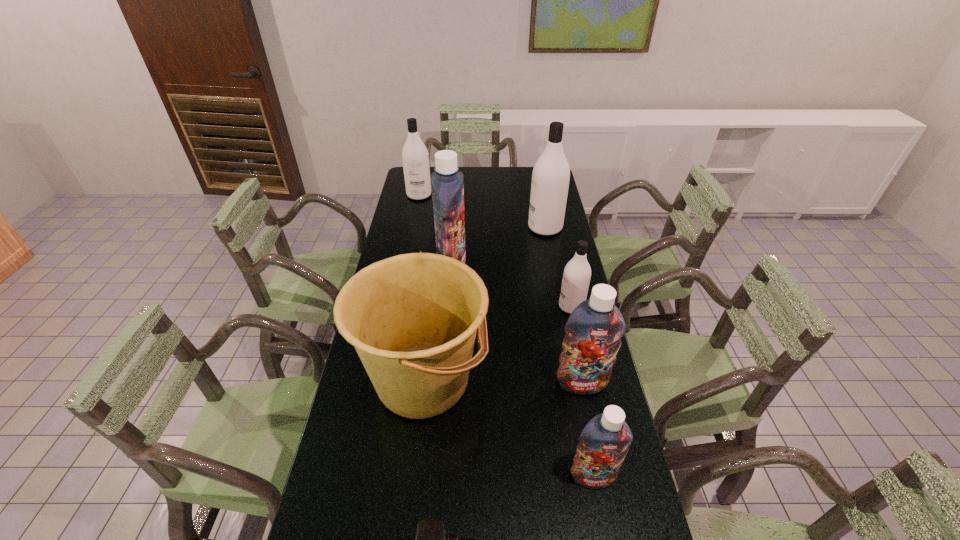
I want to click on the nearest white shampoo, so click(x=576, y=278).

Identify the location of the nearest shampoo. Image resolution: width=960 pixels, height=540 pixels. (604, 442).

The image size is (960, 540). Find the location of `the smallest blue shampoo`. the smallest blue shampoo is located at coordinates (604, 442).

The width and height of the screenshot is (960, 540). I want to click on blank area located 0.270m on the front-facing side of the second farthest shampoo, so click(464, 228).

What are the coordinates of `vacant region located 0.350m on the front-facing side of the second farthest shampoo` in the screenshot? It's located at (445, 228).

Locate an element on the screen. The width and height of the screenshot is (960, 540). free space located on the front-facing side of the second farthest shampoo is located at coordinates (467, 228).

Identify the location of free region located 0.340m on the front label of the second shampoo from left to right. The image size is (960, 540). (555, 265).

In order to click on vacant position located 0.200m on the front-facing side of the leftmost white shampoo in this screenshot , I will do `click(413, 226)`.

This screenshot has height=540, width=960. I want to click on vacant space located 0.060m on the front label of the second biggest blue shampoo, so click(x=588, y=415).

The width and height of the screenshot is (960, 540). In order to click on vacant area located 0.110m on the side of the bucket with the handle in this screenshot , I will do `click(525, 380)`.